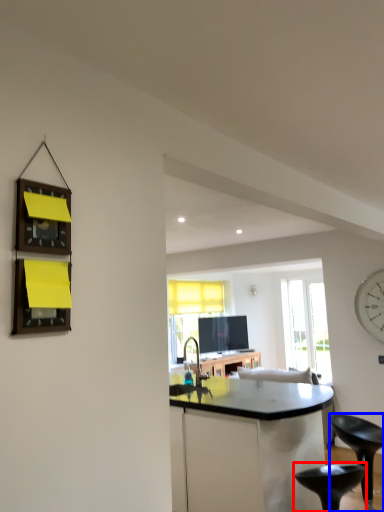
Question: Among these objects, which one is nearest to the camera, stool (highlighted by a red box) or stool (highlighted by a blue box)?

Choices:
 (A) stool
 (B) stool

Answer: (A)